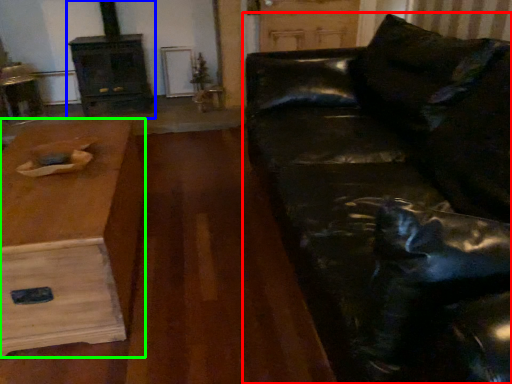
Question: Estimate the real-world distances between objects in this image. Which object is closer to studio couch (highlighted by a red box), fireplace (highlighted by a blue box) or table (highlighted by a green box)?

Choices:
 (A) fireplace
 (B) table

Answer: (B)